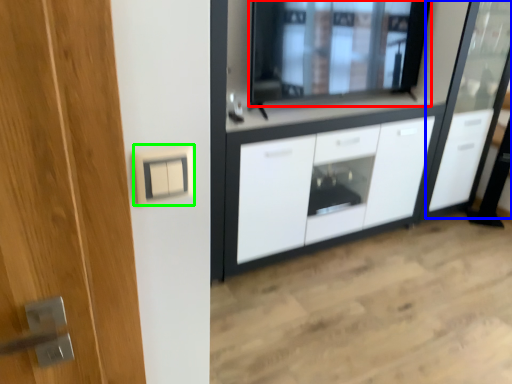
Question: Which object is positioned closest to window (highlighted by a red box)? Select from screen door (highlighted by a blue box) and electric outlet (highlighted by a green box).

Choices:
 (A) screen door
 (B) electric outlet

Answer: (A)